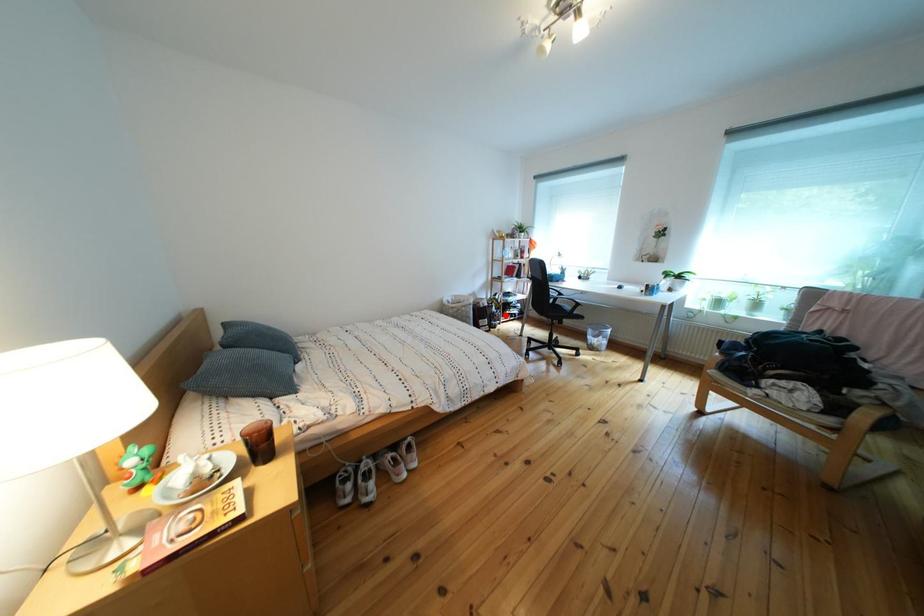
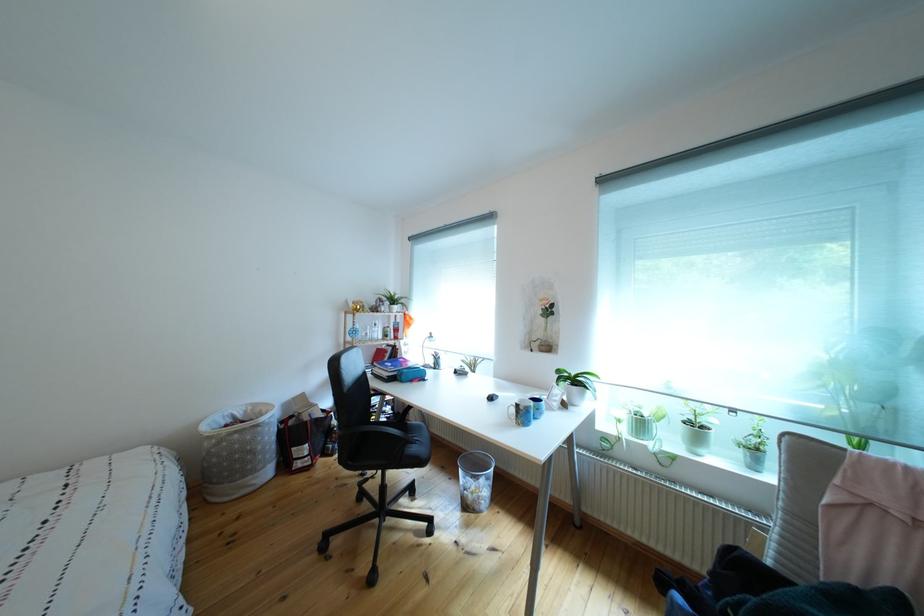
The point at the highlighted location is marked in the first image. Where is the corresponding point in the second image?

(346, 428)